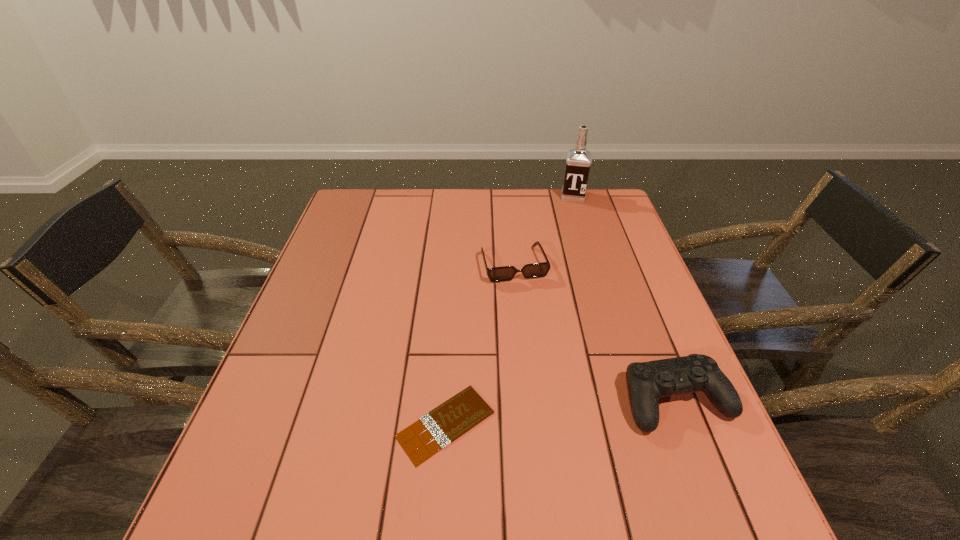
At what (x,y) coordinates should I click in order to perform the action: click on free spot on the desktop that is between the shortest object and the control and is positioned on the front label of the farthest object. Please return your answer as a coordinate pair (x, y). The width and height of the screenshot is (960, 540). Looking at the image, I should click on (555, 413).

Find the location of `free spot on the desktop that is between the shortest object and the control and is positioned on the front-facing side of the third tallest object`. free spot on the desktop that is between the shortest object and the control and is positioned on the front-facing side of the third tallest object is located at coordinates (564, 411).